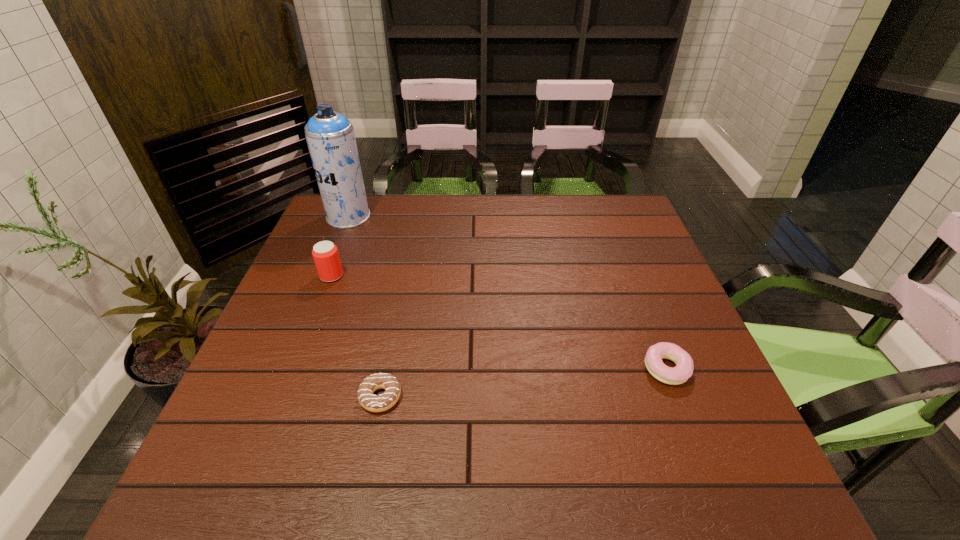
You are a GUI agent. You are given a task and a screenshot of the screen. Output one action in this format:
    pyautogui.click(x=<x>, y=<y>)
    Task: Click on the free space located 0.260m on the back of the shortest object
    The width and height of the screenshot is (960, 540).
    Given the screenshot: What is the action you would take?
    pyautogui.click(x=400, y=296)

Locate an element on the screen. Image resolution: width=960 pixels, height=540 pixels. object that is positioned at the far edge is located at coordinates (330, 136).

Where is `aerosol can located at the left edge`? This screenshot has height=540, width=960. aerosol can located at the left edge is located at coordinates [330, 136].

This screenshot has width=960, height=540. I want to click on beer can present at the left edge, so click(x=325, y=254).

You are a GUI agent. You are given a task and a screenshot of the screen. Output one action in this format:
    pyautogui.click(x=<x>, y=<y>)
    Task: Click on the object that is at the right edge
    
    Given the screenshot: What is the action you would take?
    pyautogui.click(x=684, y=368)

Identify the location of object at the far left corner. This screenshot has height=540, width=960. (330, 136).

Find the location of a particular element. Image resolution: width=960 pixels, height=540 pixels. vacant area at the far edge of the desktop is located at coordinates (551, 217).

What are the coordinates of `blank area at the near edge` in the screenshot? It's located at (311, 501).

The height and width of the screenshot is (540, 960). I want to click on blank space at the left edge of the desktop, so click(x=270, y=368).

The image size is (960, 540). I want to click on free space at the right edge of the desktop, so (x=645, y=318).